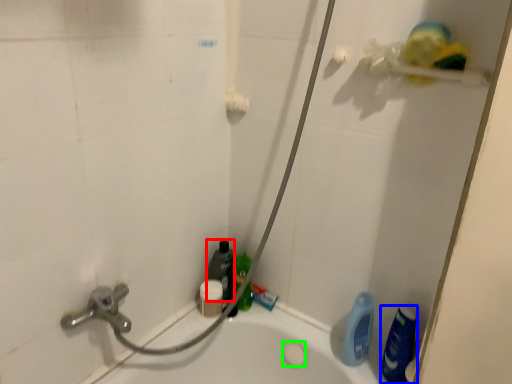
Question: Which object is positioned closest to cleaning product (highlighted by a red box)? Select from cleaning product (highlighted by a blue box) and soap (highlighted by a green box).

Choices:
 (A) cleaning product
 (B) soap

Answer: (B)